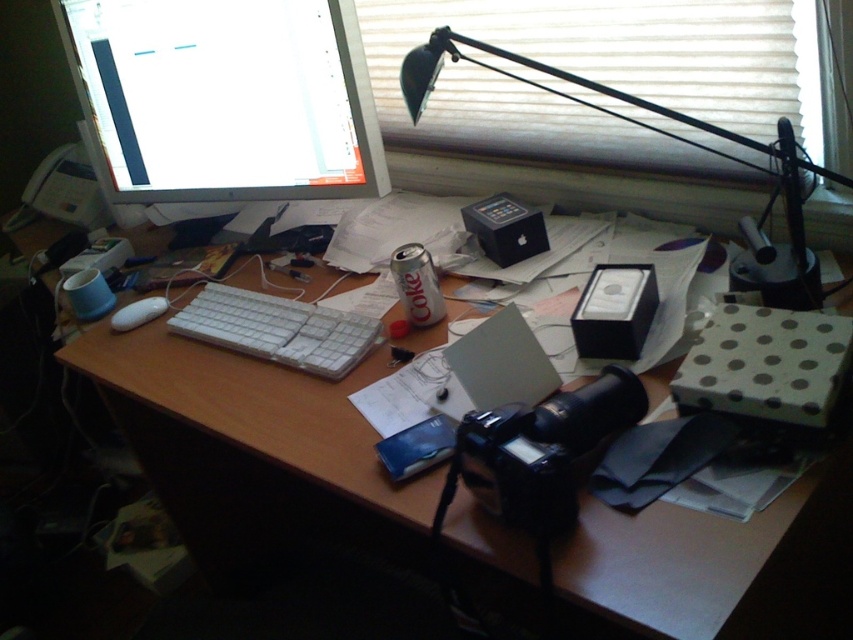
You are a person sitting at the desk and want to reach for the black metal desk lamp at upper right and the white plastic keyboard at center. Which object is taller?

The black metal desk lamp at upper right is taller than the white plastic keyboard at center.

You are organizing the desk items and need to place a new item between the white fabric blind at upper center and the white plastic keyboard at center. Based on their positions, where should you position the new item?

The new item should be placed between the white fabric blind at upper center and the white plastic keyboard at center, as the white fabric blind at upper center is to the right of the white plastic keyboard at center.